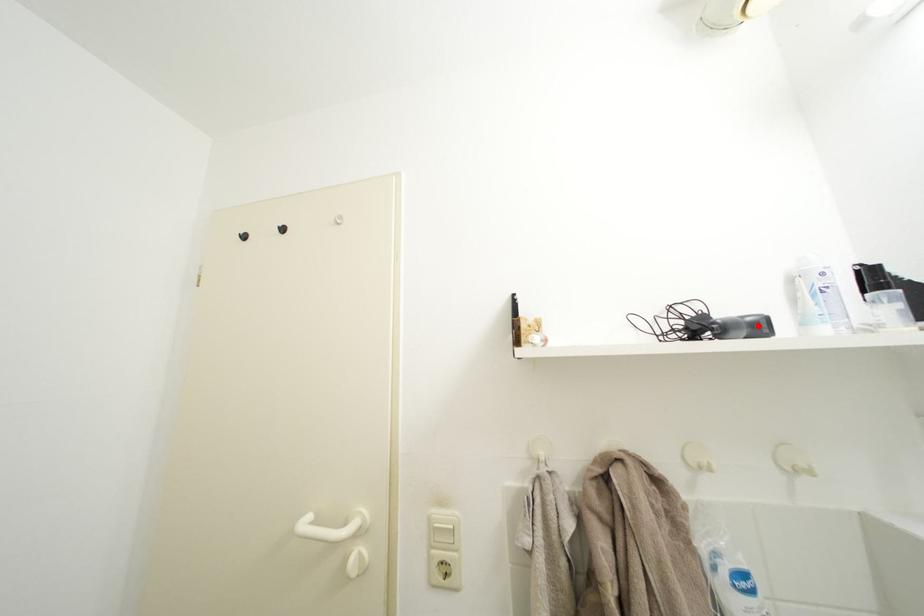
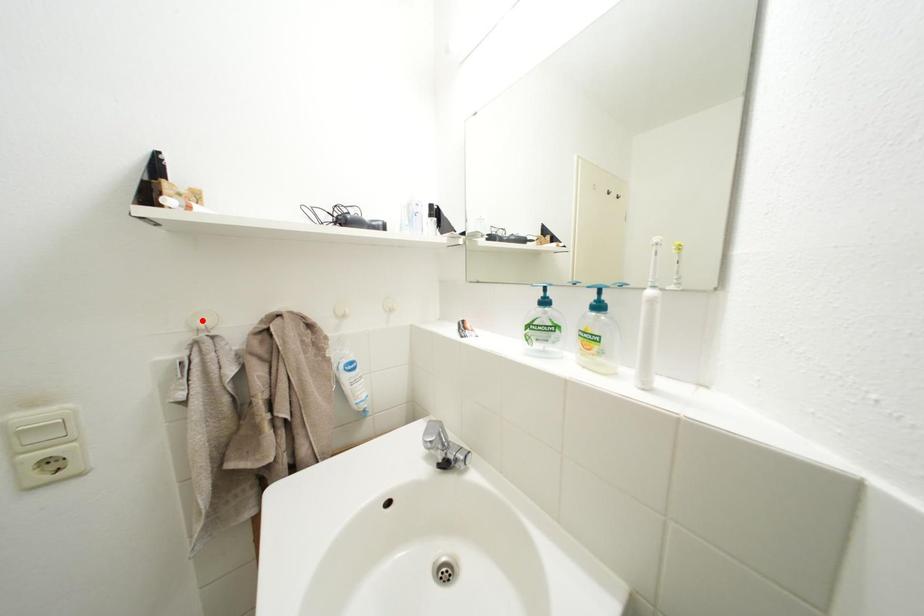
I am providing you with two images of the same scene from different viewpoints. A red point is marked on the first image and another point is marked on the second image. Do the highlighted points in image1 and image2 indicate the same real-world spot?

No